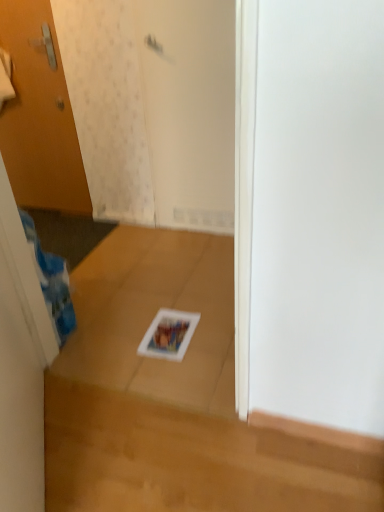
Where is `free point above matte white magazine at center (from a real-world perspective)`? The height and width of the screenshot is (512, 384). free point above matte white magazine at center (from a real-world perspective) is located at coordinates (169, 327).